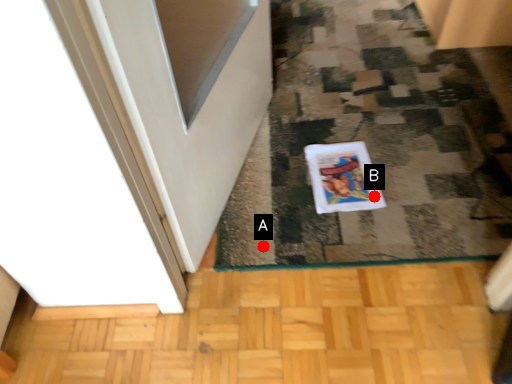
Question: Two points are circled on the image, labeled by A and B beside each circle. Which point is farther from the camera taking this photo?

Choices:
 (A) A is further
 (B) B is further

Answer: (B)